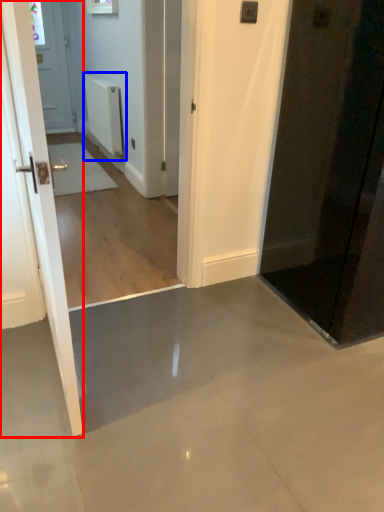
Question: Among these objects, which one is farthest to the camera, door (highlighted by a red box) or radiator (highlighted by a blue box)?

Choices:
 (A) door
 (B) radiator

Answer: (B)